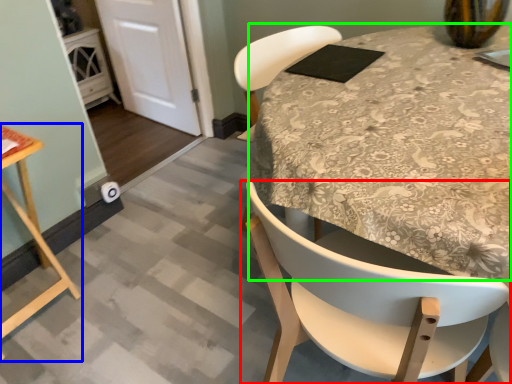
Question: Based on their relative distances, which object is farther from chair (highlighted by a red box)? Choose from table (highlighted by a blue box) and round table (highlighted by a green box).

Choices:
 (A) table
 (B) round table

Answer: (A)